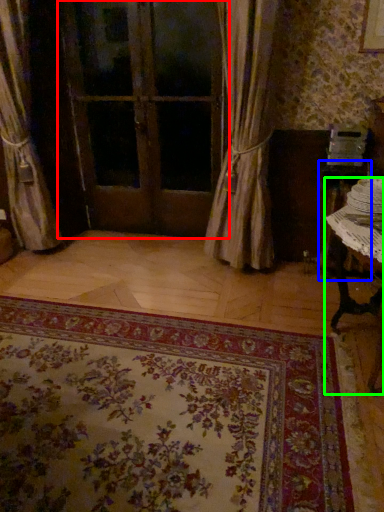
Question: Based on their relative distances, which object is nearer to door (highlighted by a red box)? Choose from table (highlighted by a blue box) and table (highlighted by a green box).

Choices:
 (A) table
 (B) table

Answer: (A)